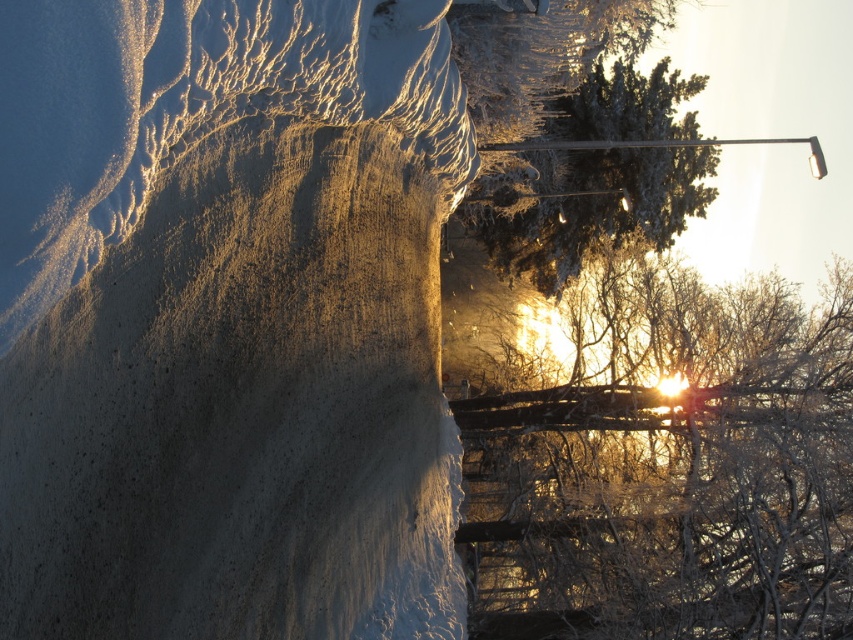
Question: Is smooth concrete cliff at center closer to camera compared to frosty white branches at upper right?

Choices:
 (A) yes
 (B) no

Answer: (A)

Question: Is smooth concrete cliff at center thinner than frosty white branches at upper right?

Choices:
 (A) no
 (B) yes

Answer: (B)

Question: Which object is closer to the camera taking this photo?

Choices:
 (A) frosty white branches at upper right
 (B) smooth concrete cliff at center

Answer: (B)

Question: Which of the following is the farthest from the observer?

Choices:
 (A) frosty white branches at upper right
 (B) smooth concrete cliff at center

Answer: (A)

Question: Is smooth concrete cliff at center to the right of frosty white branches at upper right from the viewer's perspective?

Choices:
 (A) yes
 (B) no

Answer: (B)